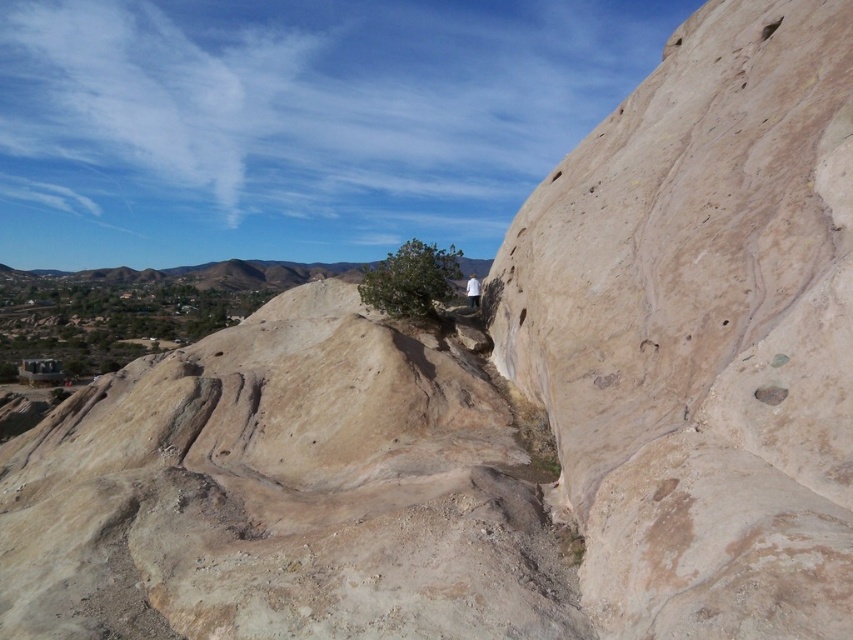
Question: Does beige rock cliff at center right have a smaller size compared to smooth beige rock at center?

Choices:
 (A) yes
 (B) no

Answer: (A)

Question: Which point is farther to the camera?

Choices:
 (A) beige rock cliff at center right
 (B) smooth beige rock at center

Answer: (B)

Question: In this image, where is beige rock cliff at center right located relative to smooth beige rock at center?

Choices:
 (A) above
 (B) below

Answer: (A)

Question: Is beige rock cliff at center right bigger than smooth beige rock at center?

Choices:
 (A) no
 (B) yes

Answer: (A)

Question: Which point is farther to the camera?

Choices:
 (A) beige rock cliff at center right
 (B) smooth beige rock at center

Answer: (B)

Question: Which object appears closest to the camera in this image?

Choices:
 (A) smooth beige rock at center
 (B) beige rock cliff at center right

Answer: (B)